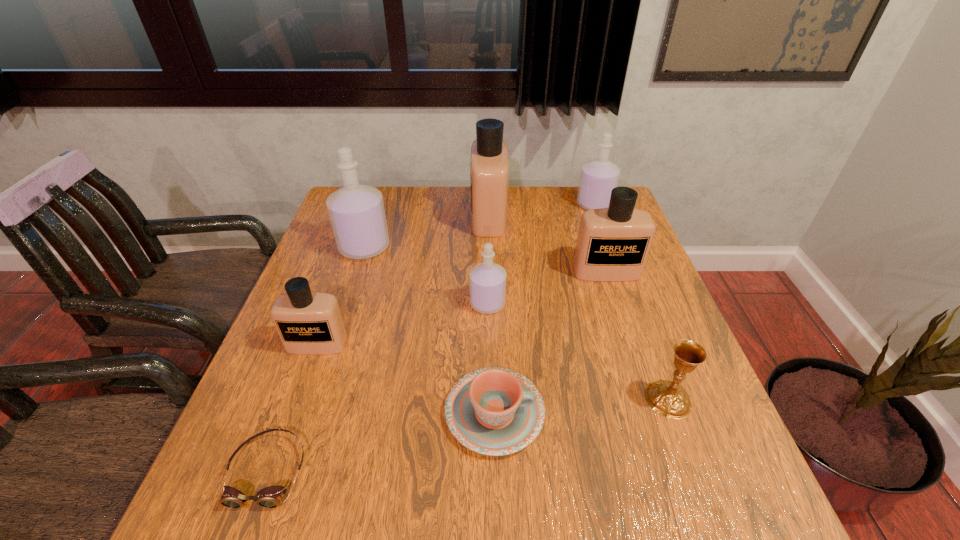
Locate an element on the screen. the second beige perfume from right to left is located at coordinates click(x=489, y=162).

Identify the location of the biggest beige perfume. This screenshot has width=960, height=540. (489, 162).

What are the coordinates of `the leftmost purple perfume` in the screenshot? It's located at (356, 211).

Identify the location of the biggest purple perfume. (356, 211).

The image size is (960, 540). What are the coordinates of `the rightmost purple perfume` in the screenshot? It's located at (598, 177).

The width and height of the screenshot is (960, 540). Identify the location of the farthest purple perfume. (598, 177).

Locate an element on the screen. The height and width of the screenshot is (540, 960). the second biggest beige perfume is located at coordinates (613, 243).

Find the location of a particular element. Image resolution: width=960 pixels, height=540 pixels. the second nearest beige perfume is located at coordinates (613, 243).

Identify the location of the second purple perfume from right to left. The image size is (960, 540). (487, 281).

Identify the location of the nearest purple perfume. (487, 281).